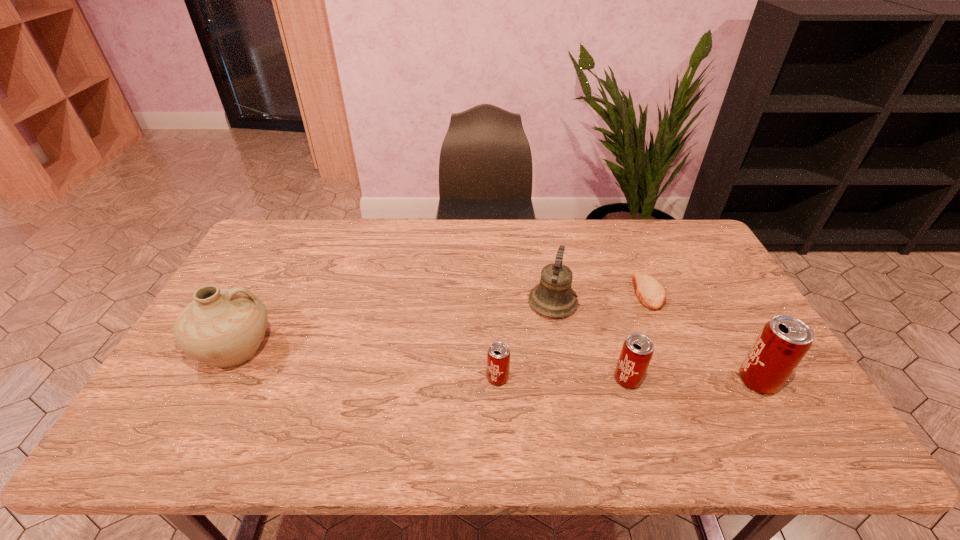
The width and height of the screenshot is (960, 540). Identify the location of the fifth object from right to left. (498, 356).

You are a GUI agent. You are given a task and a screenshot of the screen. Output one action in this format:
    pyautogui.click(x=<x>, y=<y>)
    Task: Click on the shortest beer can
    The height and width of the screenshot is (540, 960).
    Given the screenshot: What is the action you would take?
    pyautogui.click(x=498, y=356)

Locate an element on the screen. Image resolution: width=960 pixels, height=540 pixels. the second beer can from left to right is located at coordinates (637, 350).

Find the location of `the second tallest beer can`. the second tallest beer can is located at coordinates (637, 350).

I want to click on the rightmost beer can, so click(x=783, y=342).

You are a GUI agent. You are given a task and a screenshot of the screen. Output one action in this format:
    pyautogui.click(x=<x>, y=<y>)
    Task: Click on the tallest beer can
    
    Given the screenshot: What is the action you would take?
    pyautogui.click(x=783, y=342)

This screenshot has height=540, width=960. Identify the location of pottery. [222, 327].

This screenshot has width=960, height=540. Find the location of `the shortest object`. the shortest object is located at coordinates (651, 293).

At what (x,y) coordinates should I click in order to perform the action: click on pita bread. Please return your answer as a coordinate pair (x, y). Looking at the image, I should click on (651, 293).

Locate an element on the screen. The image size is (960, 540). the fourth object from right to left is located at coordinates (553, 297).